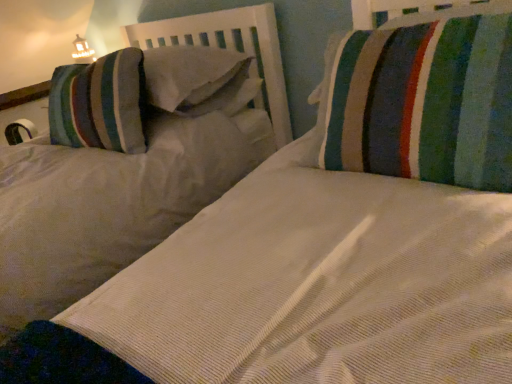
Question: Should I look upward or downward to see striped fabric pillow at upper right?

Choices:
 (A) up
 (B) down

Answer: (A)